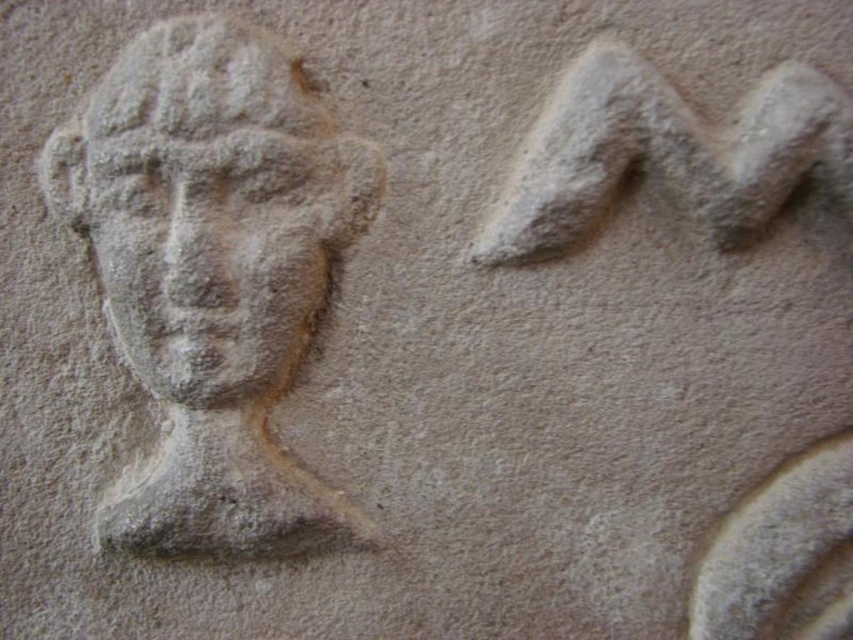
You are an archaeologist examining the ancient stone carving. You notice two figures carved into the stone. The gray stone head at left and the gray stone face at center. Which one is bigger?

The gray stone head at left is larger in size than the gray stone face at center.

Based on the scene description, which object is positioned higher in the image, the gray stone head at left or the gray stone face at center?

The gray stone head at left is positioned above the gray stone face at center, so it is higher in the image.

You are an archaeologist examining the ancient stone carving. You notice two features, the gray stone head at left and the gray stone face at center. Which one has a greater height?

The gray stone head at left is taller than the gray stone face at center.